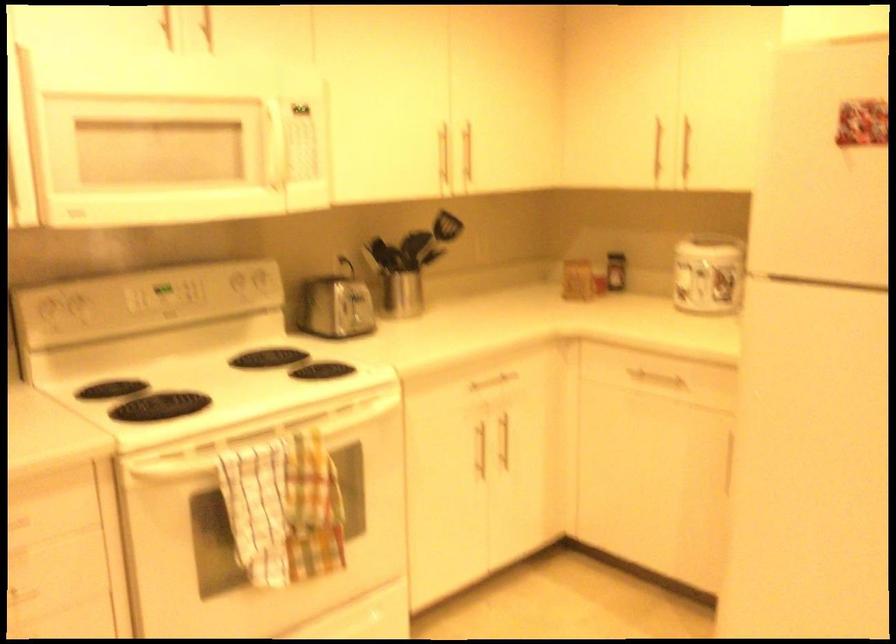
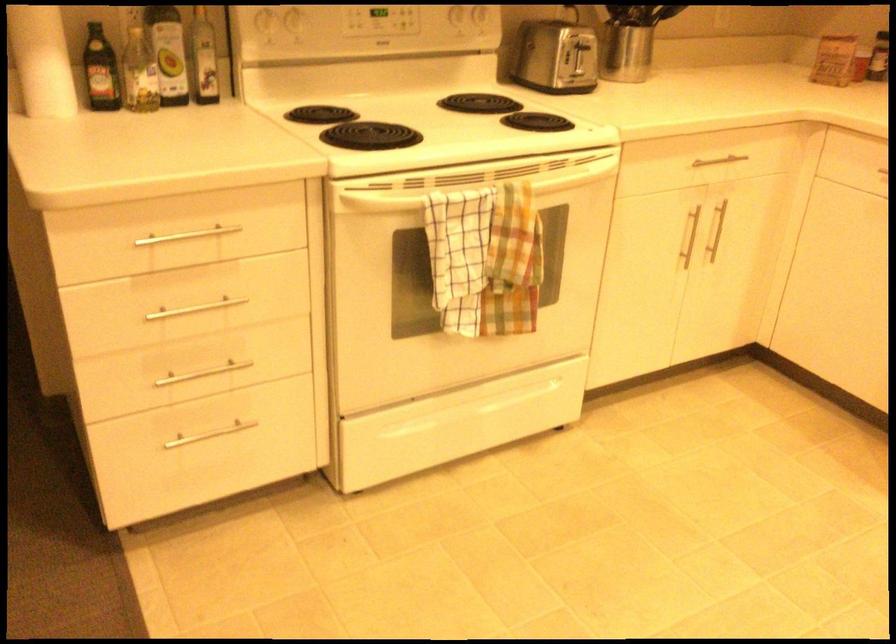
In the second image, find the point that corresponds to [521,377] in the first image.

(745, 164)